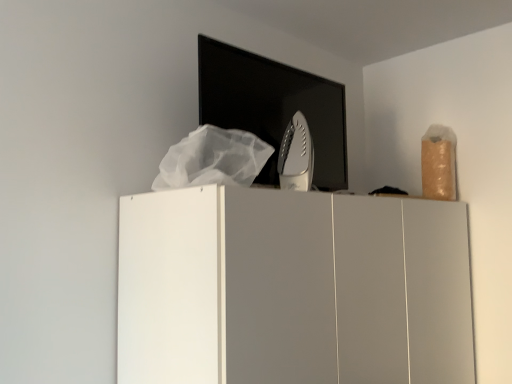
Question: Is white plastic iron at center bigger or smaller than white matte cupboard at center?

Choices:
 (A) small
 (B) big

Answer: (A)

Question: Considering the relative positions of white plastic iron at center and white matte cupboard at center in the image provided, is white plastic iron at center to the left or to the right of white matte cupboard at center?

Choices:
 (A) left
 (B) right

Answer: (A)

Question: Is white plastic iron at center in front of or behind white matte cupboard at center in the image?

Choices:
 (A) behind
 (B) front

Answer: (A)

Question: Considering the positions of white matte cupboard at center and white plastic iron at center in the image, is white matte cupboard at center bigger or smaller than white plastic iron at center?

Choices:
 (A) small
 (B) big

Answer: (B)

Question: From a real-world perspective, is white matte cupboard at center physically located above or below white plastic iron at center?

Choices:
 (A) above
 (B) below

Answer: (B)

Question: Relative to white plastic iron at center, is white matte cupboard at center in front or behind?

Choices:
 (A) behind
 (B) front

Answer: (B)

Question: Choose the correct answer: Is white matte cupboard at center inside white plastic iron at center or outside it?

Choices:
 (A) outside
 (B) inside

Answer: (A)